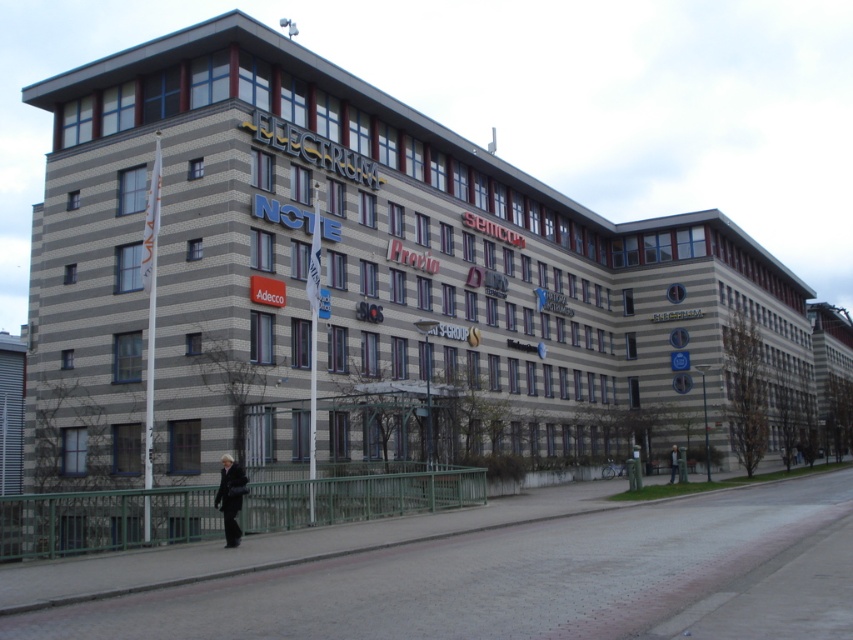
Is point (225, 506) behind point (672, 468)?

That is False.

From the picture: Between black leather coat at lower center and black leather jacket at lower center, which one has less height?

black leather coat at lower center is shorter.

This screenshot has height=640, width=853. Describe the element at coordinates (230, 497) in the screenshot. I see `black leather coat at lower center` at that location.

At what (x,y) coordinates should I click in order to perform the action: click on black leather coat at lower center. Please return your answer as a coordinate pair (x, y). This screenshot has height=640, width=853. Looking at the image, I should click on (230, 497).